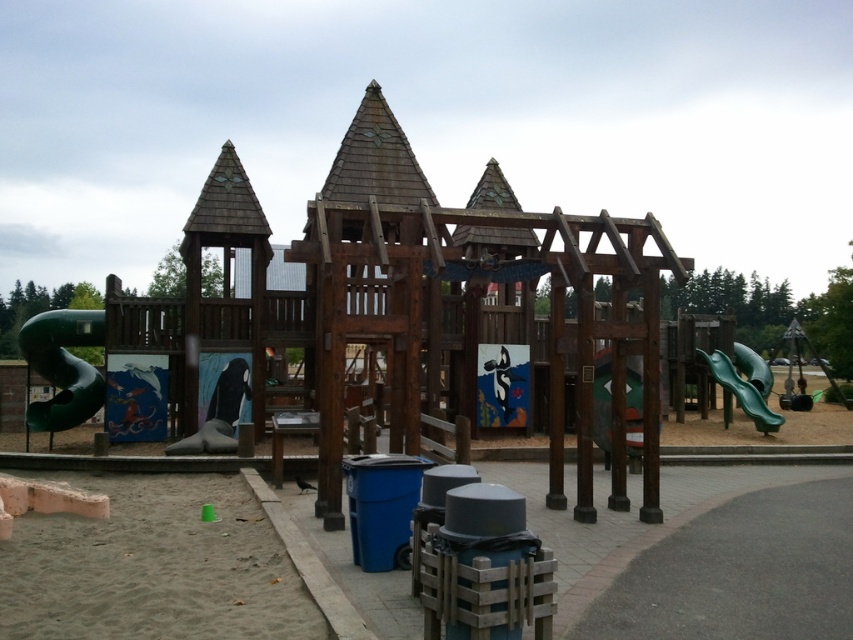
You are standing at the center of the playground structure. You want to find the sandy beige sand at lower left. According to the coordinates provided, in which direction should you move to reach it?

The sandy beige sand at lower left is located at coordinates point (154, 566). Since you are at the center, moving towards the lower left direction will lead you to the sandy beige sand at lower left.

You are standing at the point marked as point (602, 401) in the playground. What object is located exactly at that point?

The green matte slide at center is located exactly at point (602, 401).

You are a parent wanting to choose between the matte black slide at center and the green matte slide at right for your child to play on. Based on their sizes, which slide would you recommend if your child prefers a more thrilling slide?

The green matte slide at right is larger in size compared to the matte black slide at center, so it would provide a more thrilling experience for the child.